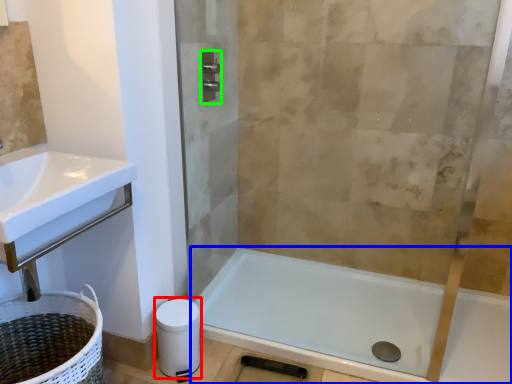
Question: Estimate the real-world distances between objects in this image. Which object is farther from toilet paper (highlighted by a red box), bathtub (highlighted by a blue box) or towel bar (highlighted by a green box)?

Choices:
 (A) bathtub
 (B) towel bar

Answer: (B)